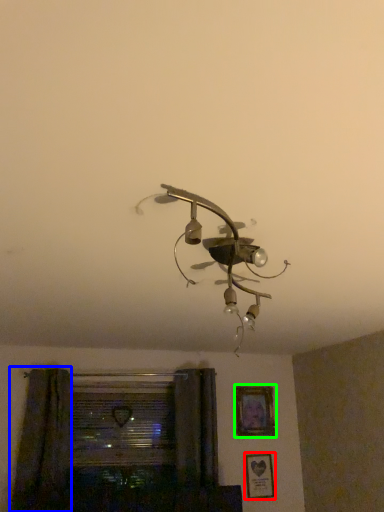
Question: Based on their relative distances, which object is farther from picture frame (highlighted by a red box)? Choose from curtain (highlighted by a blue box) and picture frame (highlighted by a green box).

Choices:
 (A) curtain
 (B) picture frame

Answer: (A)